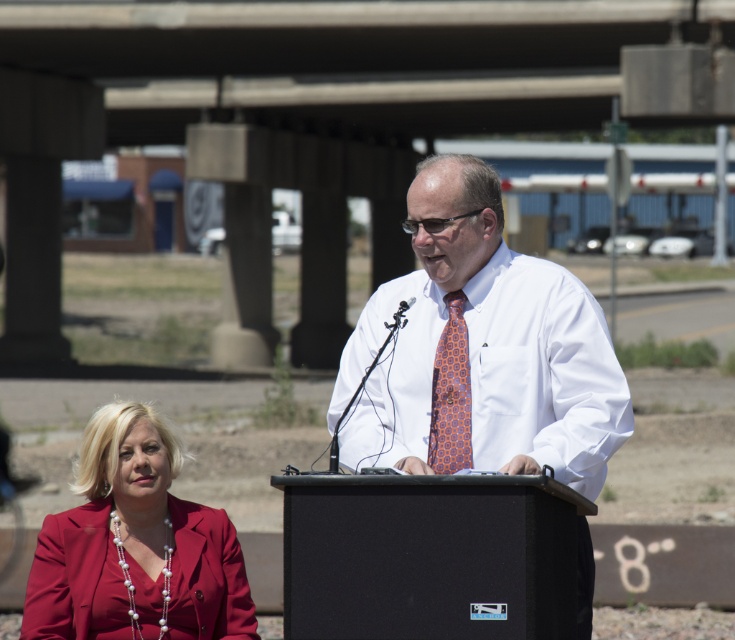
You are a photographer setting up for an event under the overpass. You need to place a large equipment box that is 2 meters wide. Can the concrete at center accommodate this box without overlapping the matte red blazer at lower left?

The concrete at center is wider than the matte red blazer at lower left, so it should have enough space to place the 2m box without overlapping the blazer.

In the scene shown: You are a photographer trying to capture a clear shot of both the black plastic speaker at center and the orange hexagonal tie at center. Based on their positions, which object should you focus on first to ensure both are in frame?

The black plastic speaker at center is positioned on the right side of orange hexagonal tie at center, so you should focus on the orange hexagonal tie at center first to ensure both are in frame.

You are standing in front of the overpass structure and want to take a photo. There are two points marked in the scene, point (x=562, y=336) and point (x=429, y=436). Which point is closer to you?

Point (x=562, y=336) is closer to the camera than point (x=429, y=436), so it is the closer point.